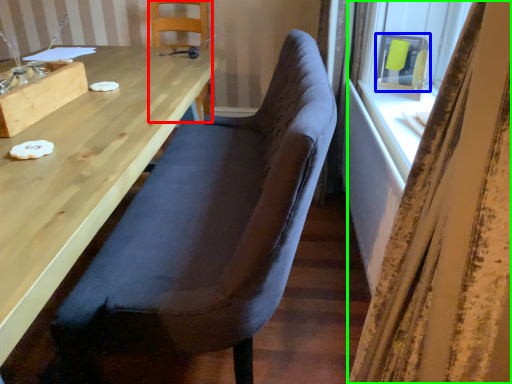
Question: Based on their relative distances, which object is farther from chair (highlighted by a red box)? Choose from window screen (highlighted by a blue box) and curtain (highlighted by a green box).

Choices:
 (A) window screen
 (B) curtain

Answer: (B)